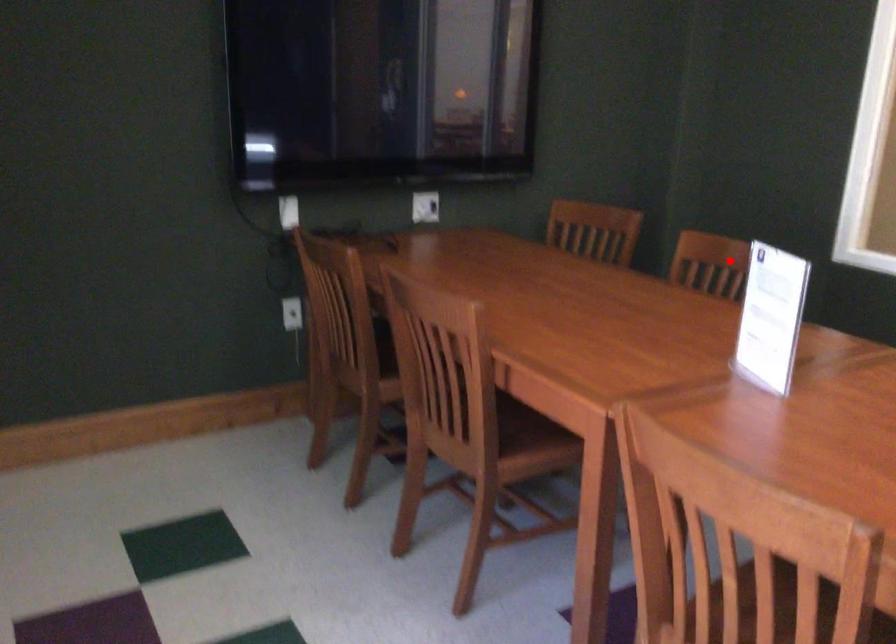
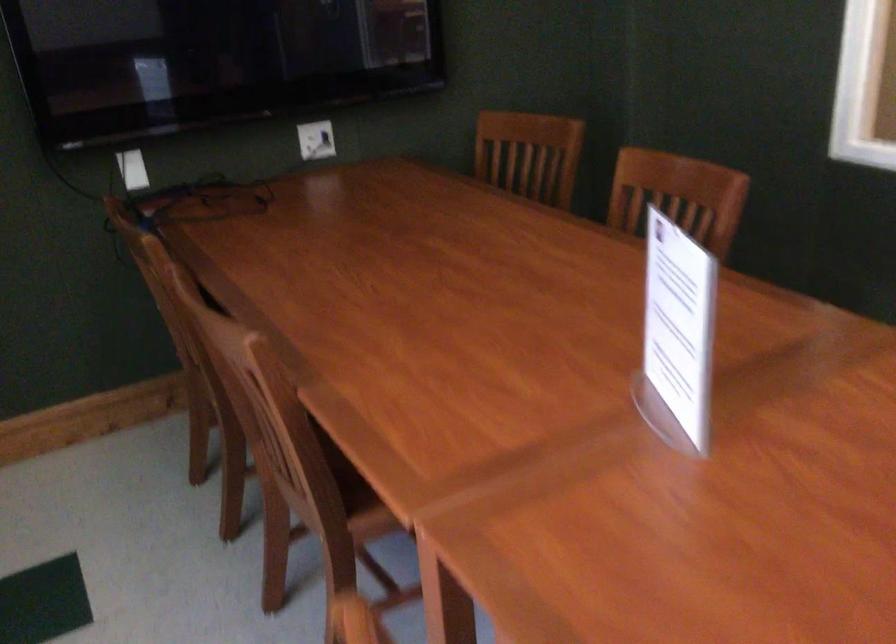
The point at the highlighted location is marked in the first image. Where is the corresponding point in the second image?

(677, 196)